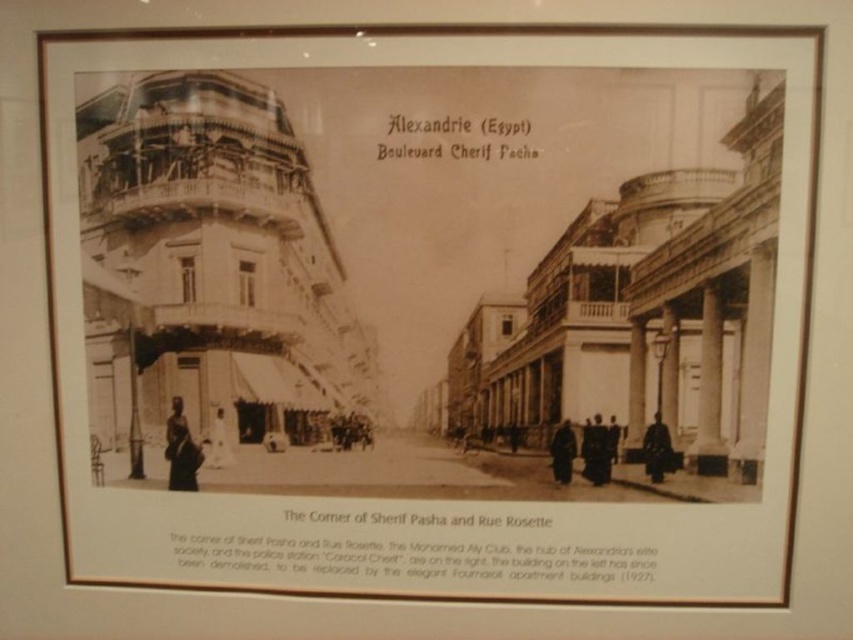
Question: Estimate the real-world distances between objects in this image. Which object is closer to the dark skin figure at lower left?

Choices:
 (A) black matte coat at center
 (B) dark brown leather coat at right

Answer: (A)

Question: Considering the relative positions of dark skin figure at lower left and dark brown leather coat at right in the image provided, where is dark skin figure at lower left located with respect to dark brown leather coat at right?

Choices:
 (A) left
 (B) right

Answer: (A)

Question: Can you confirm if dark brown leather coat at center is positioned above dark skin person at center?

Choices:
 (A) yes
 (B) no

Answer: (B)

Question: Where is black matte coat at center located in relation to dark skin person at center in the image?

Choices:
 (A) below
 (B) above

Answer: (A)

Question: Which object appears closest to the camera in this image?

Choices:
 (A) black matte coat at center
 (B) dark skin person at center
 (C) dark brown leather coat at center
 (D) dark brown leather coat at right

Answer: (D)

Question: Among these points, which one is farthest from the camera?

Choices:
 (A) (592, 424)
 (B) (614, 458)
 (C) (566, 442)

Answer: (C)